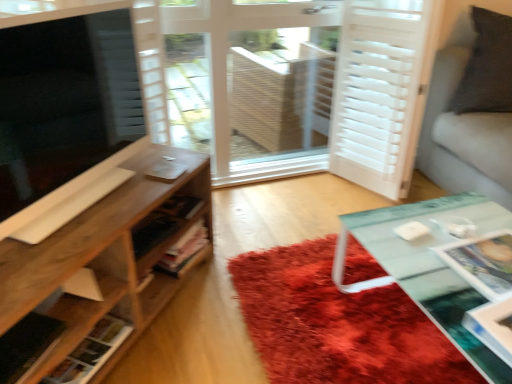
Question: Is white wooden screen door at center, arranged as the 1th screen door when viewed from the left, thinner than shaggy red rug at center?

Choices:
 (A) no
 (B) yes

Answer: (B)

Question: Can you confirm if white wooden screen door at center, marked as the second screen door in a right-to-left arrangement, is smaller than shaggy red rug at center?

Choices:
 (A) yes
 (B) no

Answer: (B)

Question: Is white wooden screen door at center, marked as the second screen door in a right-to-left arrangement, closer to camera compared to shaggy red rug at center?

Choices:
 (A) yes
 (B) no

Answer: (B)

Question: Is white wooden screen door at center, marked as the second screen door in a right-to-left arrangement, beside shaggy red rug at center?

Choices:
 (A) yes
 (B) no

Answer: (B)

Question: Is white wooden screen door at center, marked as the second screen door in a right-to-left arrangement, surrounding shaggy red rug at center?

Choices:
 (A) yes
 (B) no

Answer: (B)

Question: From a real-world perspective, is white wooden screen door at center, arranged as the 1th screen door when viewed from the left, on shaggy red rug at center?

Choices:
 (A) no
 (B) yes

Answer: (B)

Question: Is wooden shelf at left, the second shelf when ordered from bottom to top, looking in the opposite direction of matte black tv at left?

Choices:
 (A) no
 (B) yes

Answer: (A)

Question: Is wooden shelf at left, the second shelf when ordered from bottom to top, beside matte black tv at left?

Choices:
 (A) no
 (B) yes

Answer: (A)

Question: Is matte black tv at left completely or partially inside wooden shelf at left, the second shelf when ordered from bottom to top?

Choices:
 (A) yes
 (B) no

Answer: (B)

Question: Considering the relative sizes of wooden shelf at left, the second shelf when ordered from bottom to top, and matte black tv at left in the image provided, is wooden shelf at left, the second shelf when ordered from bottom to top, bigger than matte black tv at left?

Choices:
 (A) yes
 (B) no

Answer: (A)

Question: Is wooden shelf at left, positioned as the first shelf in top-to-bottom order, thinner than matte black tv at left?

Choices:
 (A) yes
 (B) no

Answer: (B)

Question: Could you tell me if wooden shelf at left, positioned as the first shelf in top-to-bottom order, is facing matte black tv at left?

Choices:
 (A) no
 (B) yes

Answer: (A)

Question: Considering the relative sizes of white wooden screen door at center, arranged as the 1th screen door when viewed from the left, and wooden shelf at lower left, which is the second shelf in top-to-bottom order, in the image provided, is white wooden screen door at center, arranged as the 1th screen door when viewed from the left, wider than wooden shelf at lower left, which is the second shelf in top-to-bottom order,?

Choices:
 (A) yes
 (B) no

Answer: (A)